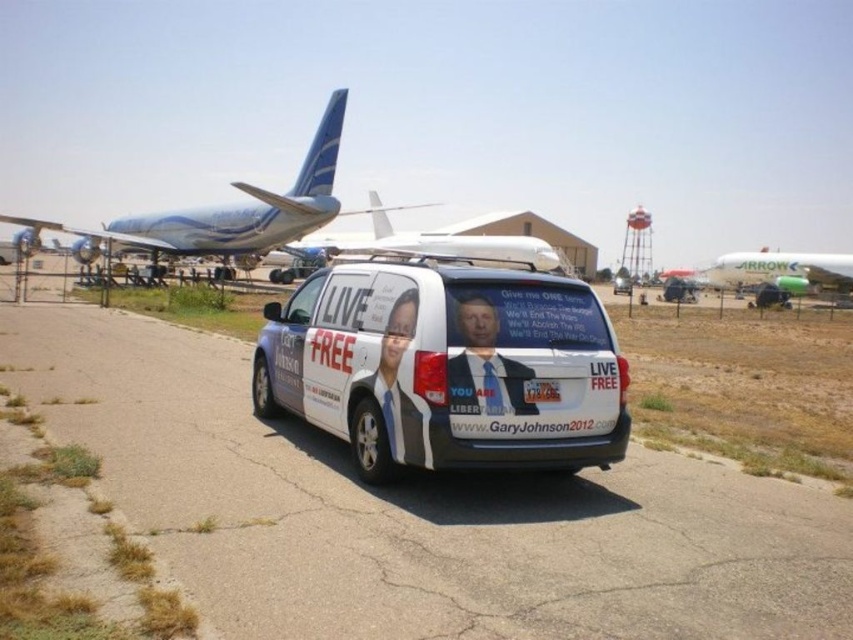
Looking at this image, which of these two, white glossy van at center or green painted fuselage airplane at center, stands taller?

Standing taller between the two is green painted fuselage airplane at center.

Between point (474, 410) and point (838, 272), which one is positioned behind?

Point (838, 272)

You are a GUI agent. You are given a task and a screenshot of the screen. Output one action in this format:
    pyautogui.click(x=<x>, y=<y>)
    Task: Click on the white glossy van at center
    
    Given the screenshot: What is the action you would take?
    pyautogui.click(x=482, y=362)

Can you confirm if white matte van at center is positioned above white glossy van at center?

Actually, white matte van at center is below white glossy van at center.

Where is `white matte van at center`? This screenshot has height=640, width=853. white matte van at center is located at coordinates (445, 368).

Which is below, matte black suit at center or white glossy van at center?

matte black suit at center

Between point (373, 387) and point (479, 378), which one is positioned in front?

Positioned in front is point (479, 378).

Locate an element on the screen. The height and width of the screenshot is (640, 853). matte black suit at center is located at coordinates (390, 400).